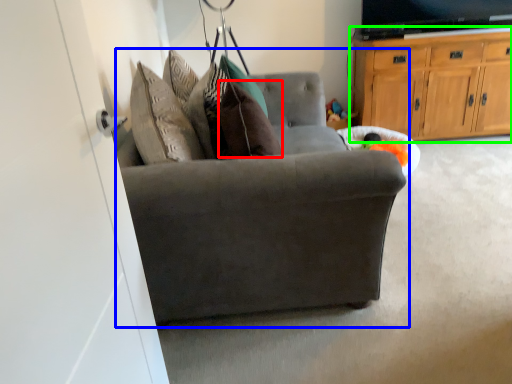
Question: Estimate the real-world distances between objects in this image. Which object is closer to pillow (highlighted by a red box), chair (highlighted by a blue box) or cabinetry (highlighted by a green box)?

Choices:
 (A) chair
 (B) cabinetry

Answer: (A)